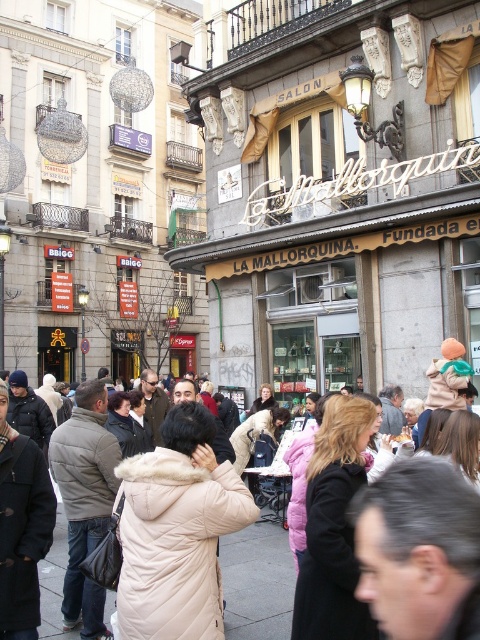
Who is positioned more to the left, matte yellow awning at center or beige wool coat at center?

Positioned to the left is beige wool coat at center.

This screenshot has height=640, width=480. Describe the element at coordinates (338, 192) in the screenshot. I see `matte yellow awning at center` at that location.

Identify the location of matte yellow awning at center. (338, 192).

Who is shorter, matte yellow awning at center or beige quilted coat at center?

beige quilted coat at center

Does matte yellow awning at center lie behind beige quilted coat at center?

Yes, it is.

Does point (274, 93) come farther from viewer compared to point (244, 556)?

Yes, it is.

The height and width of the screenshot is (640, 480). What are the coordinates of `matte yellow awning at center` in the screenshot? It's located at (338, 192).

Image resolution: width=480 pixels, height=640 pixels. Identify the location of beige wool coat at center. (257, 582).

Which of these two, beige wool coat at center or beige quilted coat at center, stands taller?

beige wool coat at center

Who is more distant from viewer, (242, 538) or (253, 538)?

The point (242, 538) is behind.

Identify the location of beige wool coat at center. The width and height of the screenshot is (480, 640). (257, 582).